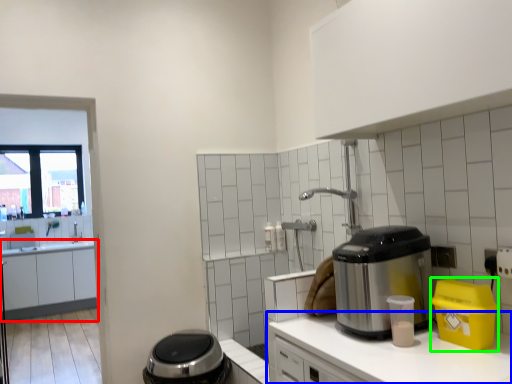
Question: Considering the real-world distances, which object is farthest from cabinetry (highlighted by a red box)? countertop (highlighted by a blue box) or appliance (highlighted by a green box)?

Choices:
 (A) countertop
 (B) appliance

Answer: (B)